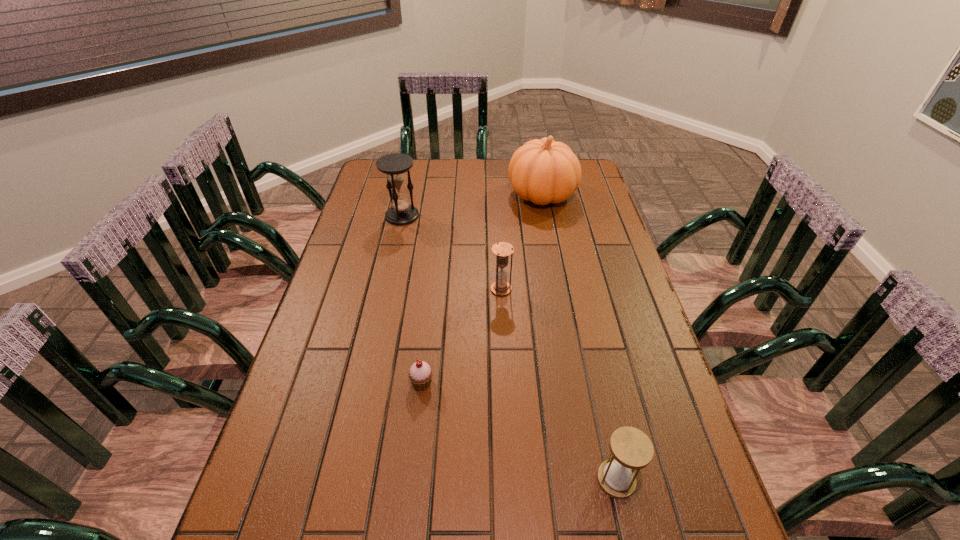
This screenshot has width=960, height=540. In order to click on free location located 0.180m on the front of the tallest hourglass in this screenshot , I will do `click(393, 259)`.

You are a GUI agent. You are given a task and a screenshot of the screen. Output one action in this format:
    pyautogui.click(x=<x>, y=<y>)
    Task: Click on the free space located on the back of the third object from right to left
    This screenshot has height=540, width=960.
    Given the screenshot: What is the action you would take?
    pyautogui.click(x=500, y=268)

Locate an element on the screen. The width and height of the screenshot is (960, 540). vacant space located on the back of the nearest hourglass is located at coordinates (599, 403).

Identify the location of free space located on the front of the fourth farthest object. [x=418, y=417].

The image size is (960, 540). What are the coordinates of `object that is at the far edge` in the screenshot? It's located at (544, 171).

Locate an element on the screen. The width and height of the screenshot is (960, 540). object that is positioned at the left edge is located at coordinates (395, 166).

Where is `pumpkin present at the right edge`? This screenshot has width=960, height=540. pumpkin present at the right edge is located at coordinates (544, 171).

The height and width of the screenshot is (540, 960). In order to click on hourglass situated at the right edge in this screenshot , I will do `click(631, 449)`.

At what (x,y) coordinates should I click in order to perform the action: click on object at the far right corner. Please return your answer as a coordinate pair (x, y). This screenshot has width=960, height=540. Looking at the image, I should click on (544, 171).

The image size is (960, 540). What are the coordinates of `free region at the far edge` in the screenshot? It's located at (447, 166).